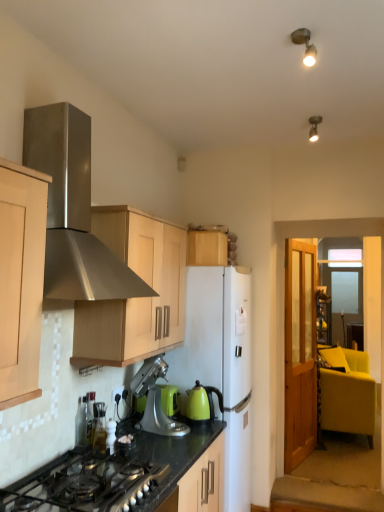
You are a GUI agent. You are given a task and a screenshot of the screen. Output one action in this format:
    pyautogui.click(x=<x>, y=<y>)
    Task: Click on the empty space that is ontop of black granite countertop at lower center (from a real-world perspective)
    Image resolution: width=384 pixels, height=512 pixels.
    Given the screenshot: What is the action you would take?
    pyautogui.click(x=166, y=439)